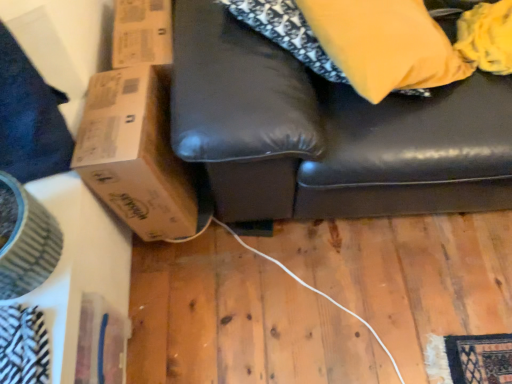
What do you see at coordinates (238, 321) in the screenshot? The height and width of the screenshot is (384, 512). I see `wooden floor at lower center` at bounding box center [238, 321].

The image size is (512, 384). I want to click on matte yellow pillow at upper right, so click(x=385, y=45).

Where is `brown cardboard box at left`? This screenshot has width=512, height=384. brown cardboard box at left is located at coordinates (135, 154).

You are a GUI agent. You are given a task and a screenshot of the screen. Output one action in this format:
    pyautogui.click(x=<x>, y=<y>)
    Task: Click on the wooden floor at lower center
    This screenshot has height=384, width=512.
    Given the screenshot: What is the action you would take?
    (x=238, y=321)

In the scene shown: From the image's perspective, relative to brown cardboard box at left, is wooden floor at lower center above or below?

Based on their image positions, wooden floor at lower center is located beneath brown cardboard box at left.

Based on the photo, is wooden floor at lower center beside brown cardboard box at left?

No, wooden floor at lower center is not touching brown cardboard box at left.

From a real-world perspective, relative to brown cardboard box at left, is wooden floor at lower center vertically above or below?

Clearly, from a real-world perspective, wooden floor at lower center is below brown cardboard box at left.

Which object is more forward, brown cardboard box at left or matte yellow pillow at upper right?

matte yellow pillow at upper right is more forward.

Is brown cardboard box at left positioned with its back to matte yellow pillow at upper right?

No, brown cardboard box at left is not facing the opposite direction of matte yellow pillow at upper right.

Which of these two, brown cardboard box at left or matte yellow pillow at upper right, is smaller?

Smaller between the two is matte yellow pillow at upper right.

Based on the photo, from the image's perspective, which object appears higher, brown cardboard box at left or matte yellow pillow at upper right?

matte yellow pillow at upper right appears higher in the image.

Identify the location of pillow in front of the wooden floor at lower center. (385, 45).

Is matte yellow pillow at upper right smaller than wooden floor at lower center?

No, matte yellow pillow at upper right is not smaller than wooden floor at lower center.

From the image's perspective, who appears lower, matte yellow pillow at upper right or wooden floor at lower center?

From the image's view, wooden floor at lower center is below.

In the scene shown: Between wooden floor at lower center and matte yellow pillow at upper right, which one appears on the left side from the viewer's perspective?

Positioned to the left is wooden floor at lower center.

From a real-world perspective, who is located lower, wooden floor at lower center or matte yellow pillow at upper right?

wooden floor at lower center is physically lower.

In the image, there is a matte yellow pillow at upper right. Where is `plywood below it (from a real-world perspective)`? This screenshot has width=512, height=384. plywood below it (from a real-world perspective) is located at coordinates (238, 321).

Do you think wooden floor at lower center is within matte yellow pillow at upper right, or outside of it?

wooden floor at lower center exists outside the volume of matte yellow pillow at upper right.

How much distance is there between matte yellow pillow at upper right and brown cardboard box at left?

matte yellow pillow at upper right is 55.90 centimeters from brown cardboard box at left.

Is matte yellow pillow at upper right far away from brown cardboard box at left?

Actually, matte yellow pillow at upper right and brown cardboard box at left are a little close together.

Considering the sizes of matte yellow pillow at upper right and brown cardboard box at left in the image, is matte yellow pillow at upper right bigger or smaller than brown cardboard box at left?

In the image, matte yellow pillow at upper right appears to be smaller than brown cardboard box at left.

Which point is more forward, (367, 98) or (113, 210)?

Point (367, 98)

Considering the relative positions of brown cardboard box at left and wooden floor at lower center in the image provided, is brown cardboard box at left to the left of wooden floor at lower center from the viewer's perspective?

Yes, brown cardboard box at left is to the left of wooden floor at lower center.

Would you consider brown cardboard box at left to be distant from wooden floor at lower center?

No.

Is brown cardboard box at left positioned with its back to wooden floor at lower center?

No, brown cardboard box at left is not facing the opposite direction of wooden floor at lower center.

This screenshot has height=384, width=512. In order to click on plywood that appears below the brown cardboard box at left (from a real-world perspective) in this screenshot , I will do `click(238, 321)`.

Find the location of a particular element. pillow lying in front of the brown cardboard box at left is located at coordinates (385, 45).

From the image, which object appears to be nearer to wooden floor at lower center, matte yellow pillow at upper right or brown cardboard box at left?

Among the two, brown cardboard box at left is located nearer to wooden floor at lower center.

Estimate the real-world distances between objects in this image. Which object is closer to matte yellow pillow at upper right, wooden floor at lower center or brown cardboard box at left?

The object closer to matte yellow pillow at upper right is brown cardboard box at left.

Considering their positions, is brown cardboard box at left positioned further to wooden floor at lower center than matte yellow pillow at upper right?

matte yellow pillow at upper right is further to wooden floor at lower center.

Considering their positions, is matte yellow pillow at upper right positioned closer to brown cardboard box at left than wooden floor at lower center?

wooden floor at lower center.

When comparing their distances from brown cardboard box at left, does wooden floor at lower center or matte yellow pillow at upper right seem further?

matte yellow pillow at upper right lies further to brown cardboard box at left than the other object.

Estimate the real-world distances between objects in this image. Which object is further from matte yellow pillow at upper right, brown cardboard box at left or wooden floor at lower center?

The object further to matte yellow pillow at upper right is wooden floor at lower center.

The image size is (512, 384). Identify the location of cardboard box between matte yellow pillow at upper right and wooden floor at lower center from top to bottom. (135, 154).